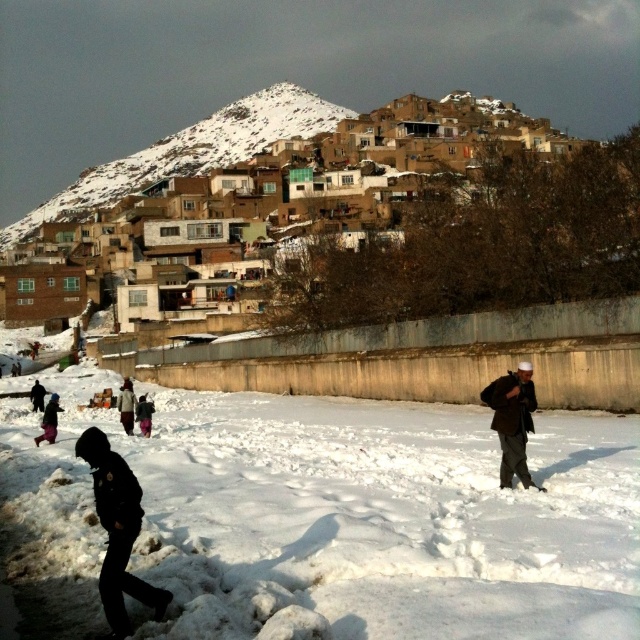
You are standing in the snowy village and see the dark brown leather bag at lower right and the dark brown jacket at lower left. Which item is positioned higher relative to the other?

The dark brown leather bag at lower right is above the dark brown jacket at lower left, so it is positioned higher.

Looking at this image, you are a photographer planning to capture the village scene. You notice the dark brown jacket at lower left and the pink fabric pants at lower left in the foreground. Which object should you adjust your focus to ensure the larger one is in sharp detail?

The dark brown jacket at lower left has a larger size compared to the pink fabric pants at lower left, so you should focus on the dark brown jacket at lower left to ensure it is in sharp detail.